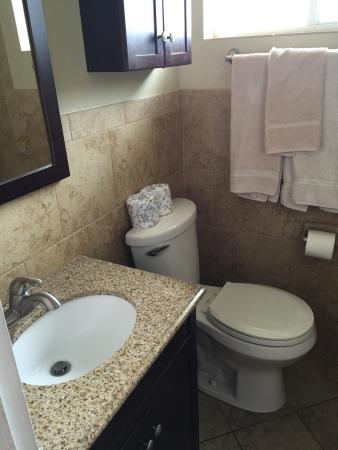
Identify the location of toilet rolls. The height and width of the screenshot is (450, 338). (167, 200), (148, 209).